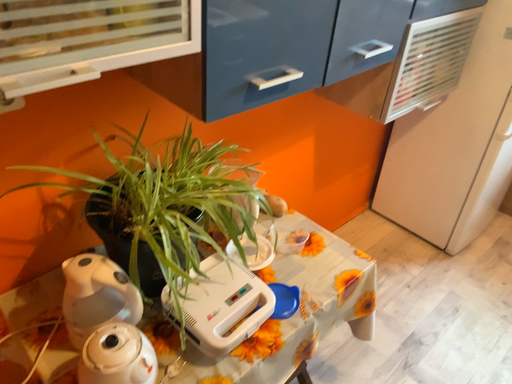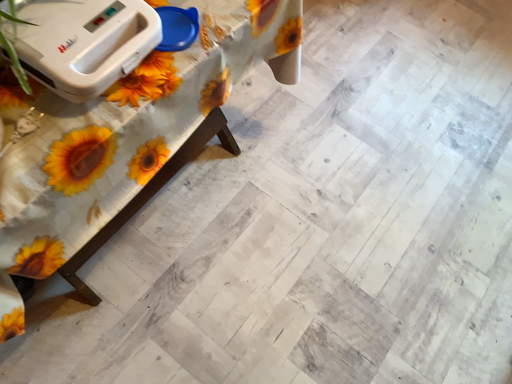
Question: Which way did the camera rotate in the video?

Choices:
 (A) rotated right
 (B) rotated left

Answer: (A)